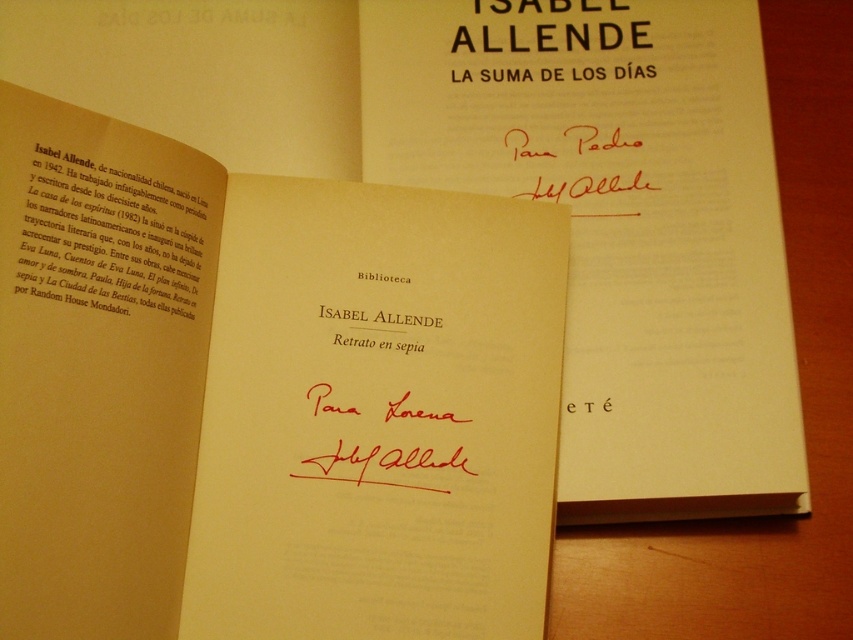
Looking at this image, is sepia paper book at center thinner than sepia paper text at upper left?

Incorrect, sepia paper book at center's width is not less than sepia paper text at upper left's.

Does point (494, 387) lie behind point (178, 259)?

Yes, point (494, 387) is farther from viewer.

Where is `sepia paper book at center`? The height and width of the screenshot is (640, 853). sepia paper book at center is located at coordinates (265, 396).